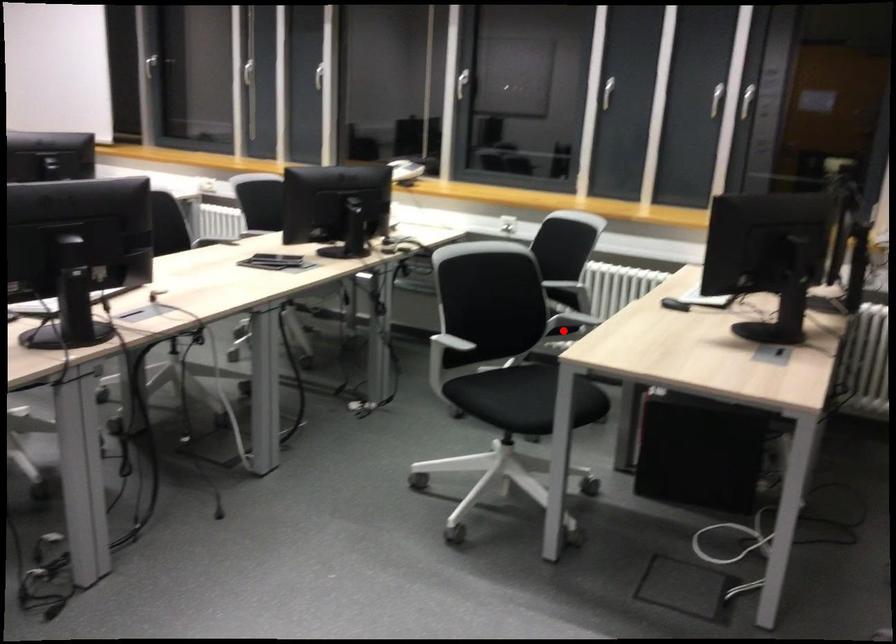
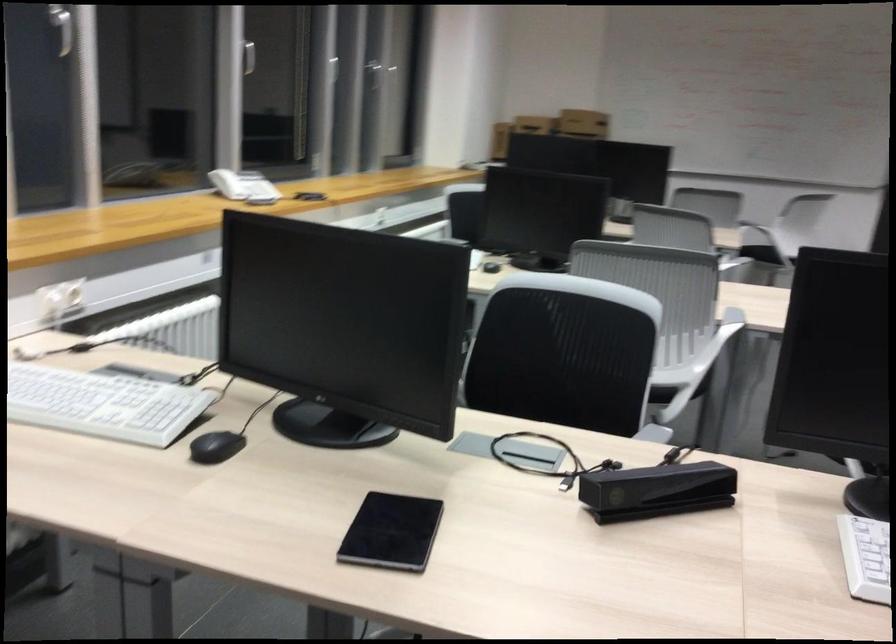
Question: I am providing you with two images of the same scene from different viewpoints. A red point is marked on the first image. At the location where the point appears in image 1, is it still visible in image 2?

Choices:
 (A) Yes
 (B) No

Answer: (B)